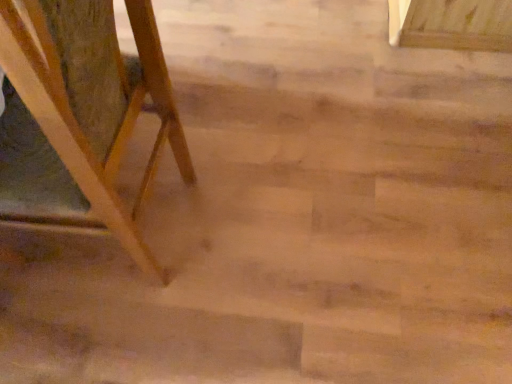
Question: Should I look upward or downward to see wooden easel at left?

Choices:
 (A) down
 (B) up

Answer: (B)